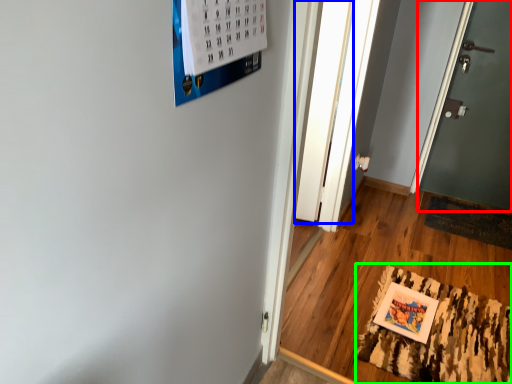
Question: Which object is the closest to the door (highlighted by a red box)? Choose among these: glass door (highlighted by a blue box) or mat (highlighted by a green box).

Choices:
 (A) glass door
 (B) mat

Answer: (A)